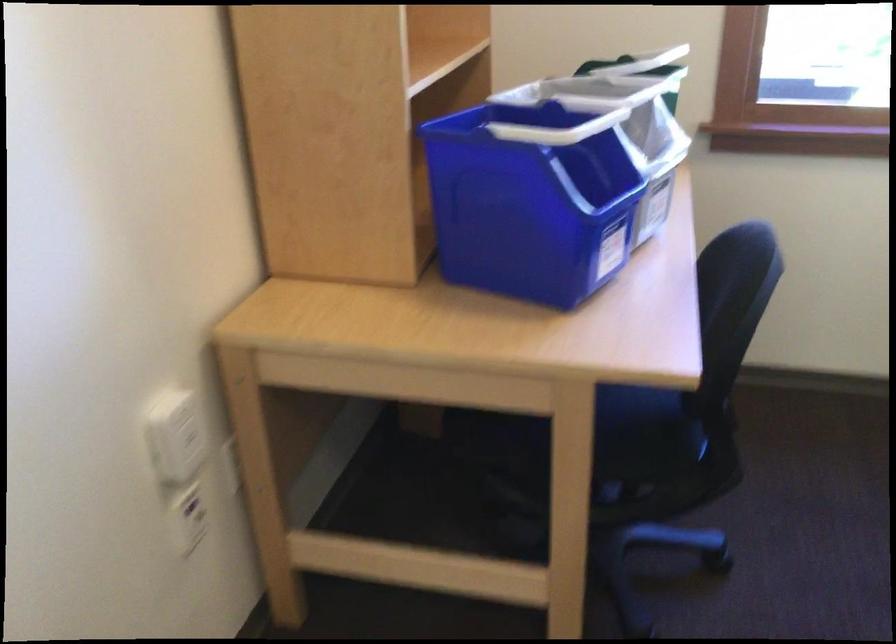
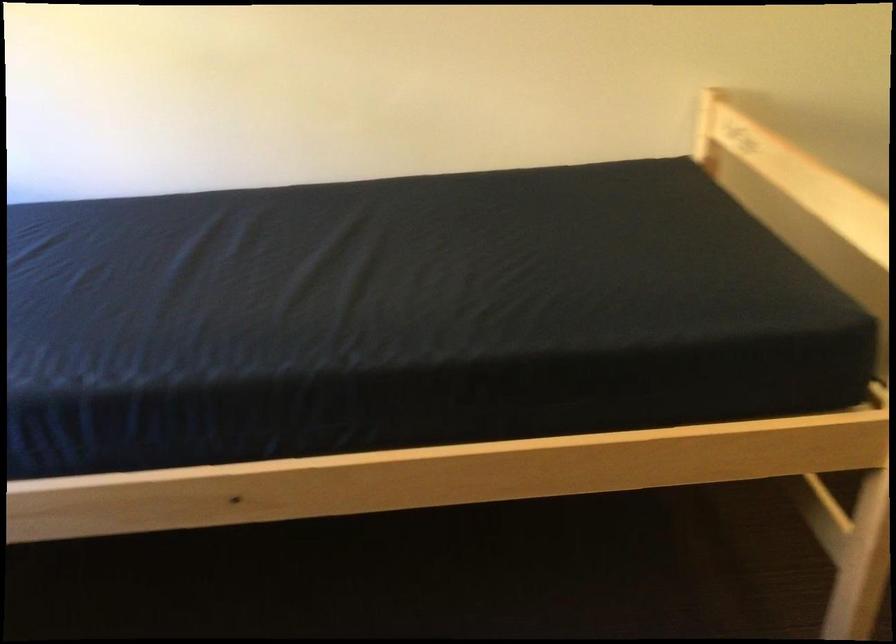
How did the camera likely rotate?

The camera's rotation is toward right-down.